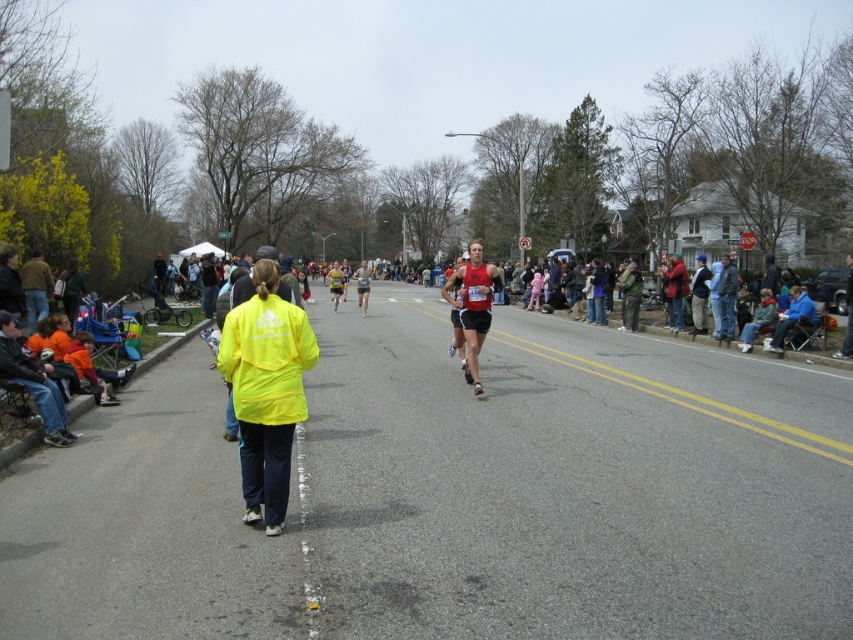
Question: Which object appears farthest from the camera in this image?

Choices:
 (A) red matte running suit at center
 (B) yellow fabric jacket at center
 (C) matte running suit at center
 (D) red jacket at center

Answer: (C)

Question: Which object is farther from the camera taking this photo?

Choices:
 (A) red jacket at center
 (B) yellow reflective jacket at center
 (C) yellow fabric jacket at center
 (D) matte running suit at center

Answer: (B)

Question: Is red jacket at center closer to camera compared to yellow reflective jacket at center?

Choices:
 (A) yes
 (B) no

Answer: (A)

Question: Where is yellow fabric jacket at center located in relation to matte running suit at center in the image?

Choices:
 (A) above
 (B) below

Answer: (B)

Question: Among these points, which one is nearest to the camera?

Choices:
 (A) (366, 280)
 (B) (466, 326)
 (C) (334, 298)
 (D) (677, 326)

Answer: (B)

Question: Is red jacket at center thinner than matte running suit at center?

Choices:
 (A) no
 (B) yes

Answer: (A)